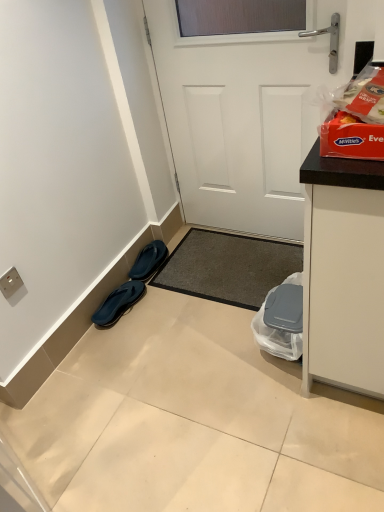
Question: Considering the relative sizes of black rubber flip-flops at lower left, which appears as the 1th footwear when ordered from the bottom, and white plastic electric outlet at lower left in the image provided, is black rubber flip-flops at lower left, which appears as the 1th footwear when ordered from the bottom, bigger than white plastic electric outlet at lower left?

Choices:
 (A) no
 (B) yes

Answer: (B)

Question: Would you say white plastic electric outlet at lower left is part of black rubber flip-flops at lower left, which appears as the 1th footwear when ordered from the bottom,'s contents?

Choices:
 (A) yes
 (B) no

Answer: (B)

Question: Does black rubber flip-flops at lower left, which appears as the 1th footwear when ordered from the bottom, appear on the left side of white plastic electric outlet at lower left?

Choices:
 (A) no
 (B) yes

Answer: (A)

Question: Is black rubber flip-flops at lower left, the second footwear when ordered from top to bottom, taller than white plastic electric outlet at lower left?

Choices:
 (A) no
 (B) yes

Answer: (A)

Question: From a real-world perspective, is black rubber flip-flops at lower left, which appears as the 1th footwear when ordered from the bottom, physically above white plastic electric outlet at lower left?

Choices:
 (A) yes
 (B) no

Answer: (B)

Question: Does black rubber flip-flops at lower left, the second footwear when ordered from top to bottom, turn towards white plastic electric outlet at lower left?

Choices:
 (A) yes
 (B) no

Answer: (B)

Question: Is white plastic electric outlet at lower left in contact with black rubber flip-flops at lower left, which is counted as the 1th footwear, starting from the top?

Choices:
 (A) no
 (B) yes

Answer: (A)

Question: Can you confirm if white plastic electric outlet at lower left is positioned to the left of black rubber flip-flops at lower left, which ranks as the second footwear in bottom-to-top order?

Choices:
 (A) yes
 (B) no

Answer: (A)

Question: Does white plastic electric outlet at lower left turn towards black rubber flip-flops at lower left, which ranks as the second footwear in bottom-to-top order?

Choices:
 (A) yes
 (B) no

Answer: (B)

Question: Considering the relative sizes of white plastic electric outlet at lower left and black rubber flip-flops at lower left, which ranks as the second footwear in bottom-to-top order, in the image provided, is white plastic electric outlet at lower left thinner than black rubber flip-flops at lower left, which ranks as the second footwear in bottom-to-top order,?

Choices:
 (A) no
 (B) yes

Answer: (B)

Question: Is black rubber flip-flops at lower left, which ranks as the second footwear in bottom-to-top order, at the back of white plastic electric outlet at lower left?

Choices:
 (A) yes
 (B) no

Answer: (B)

Question: From a real-world perspective, is white plastic electric outlet at lower left over black rubber flip-flops at lower left, which ranks as the second footwear in bottom-to-top order?

Choices:
 (A) no
 (B) yes

Answer: (B)

Question: From a real-world perspective, is white matte door at center positioned over black rubber flip-flops at lower left, which ranks as the second footwear in bottom-to-top order, based on gravity?

Choices:
 (A) no
 (B) yes

Answer: (B)